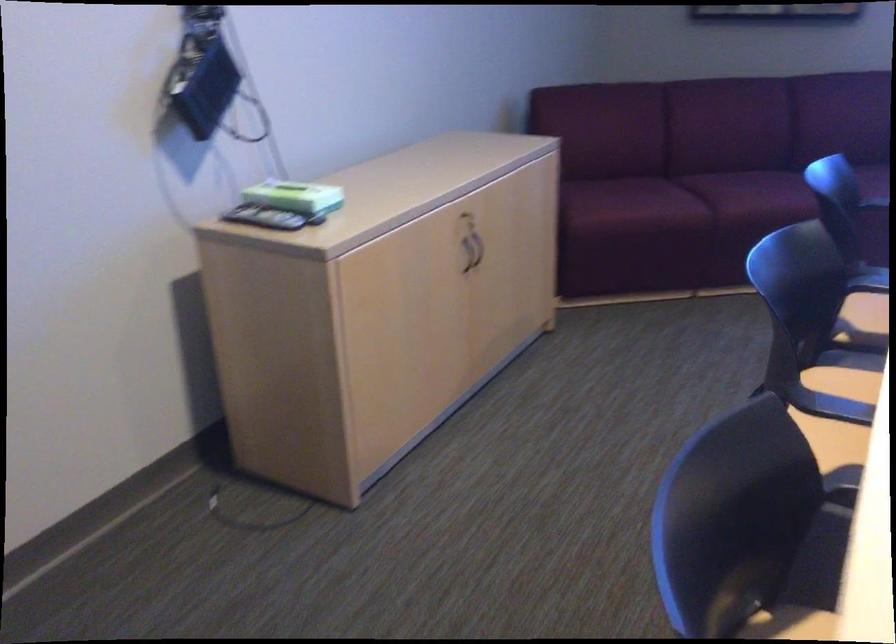
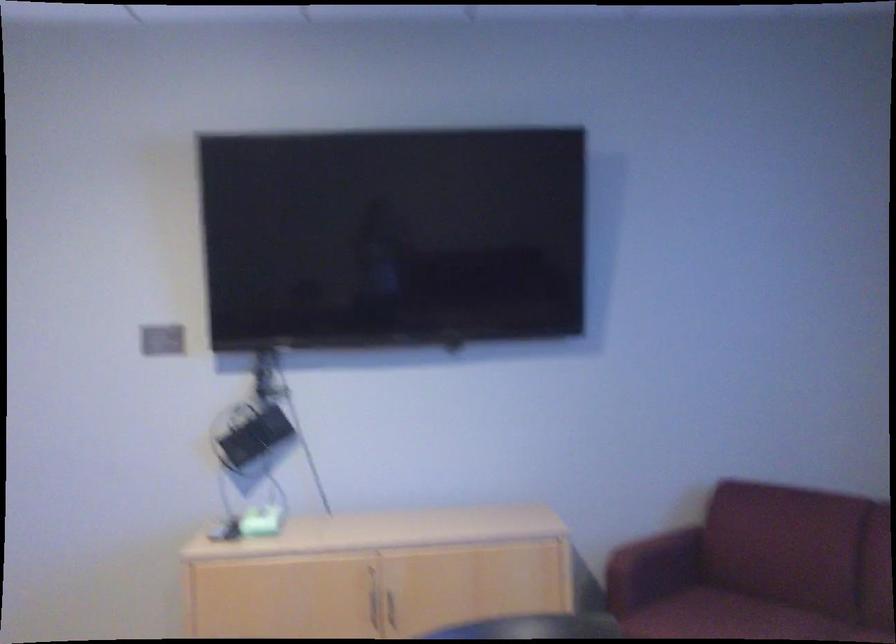
The point at (470, 251) is marked in the first image. Where is the corresponding point in the second image?

(374, 607)